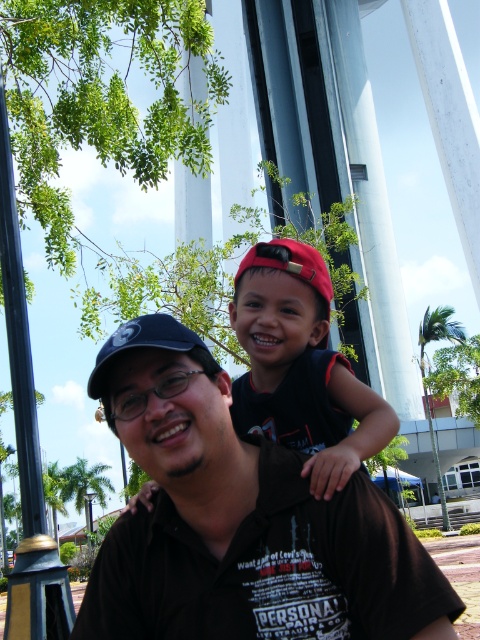
You are standing in front of the scene described. Where is the matte black baseball cap at center located in terms of coordinates?

The matte black baseball cap at center is located at coordinates point (141, 344).

You are standing in front of the matte black baseball cap at center and the brushed metal lamp post at left. Which object is closer to you?

The matte black baseball cap at center is closer to you because it is in front of the brushed metal lamp post at left.